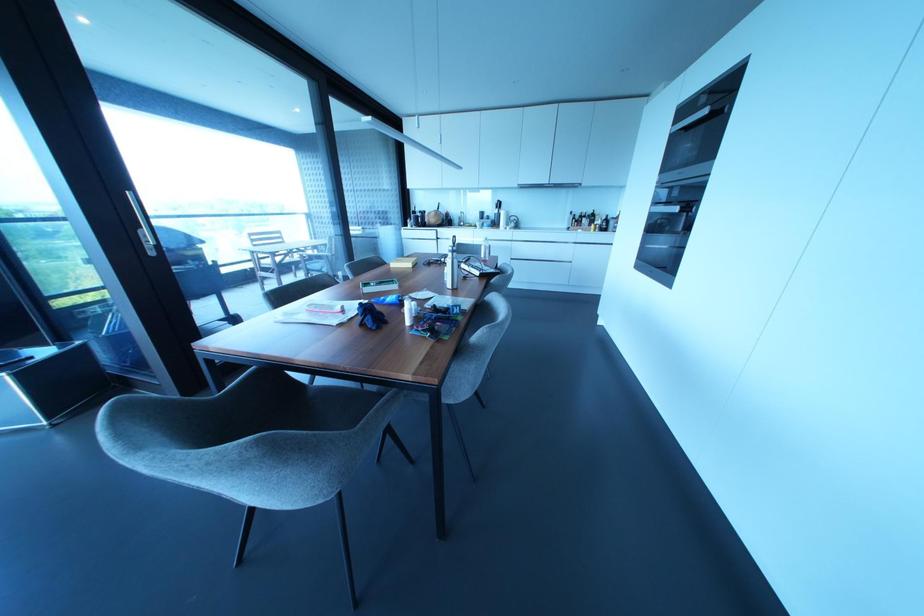
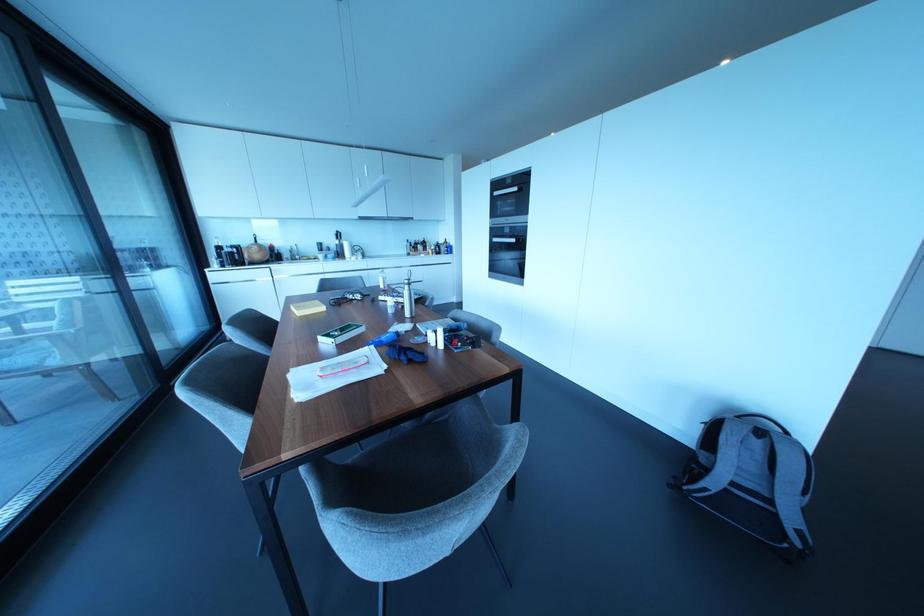
The point at (448, 254) is marked in the first image. Where is the corresponding point in the second image?

(406, 286)